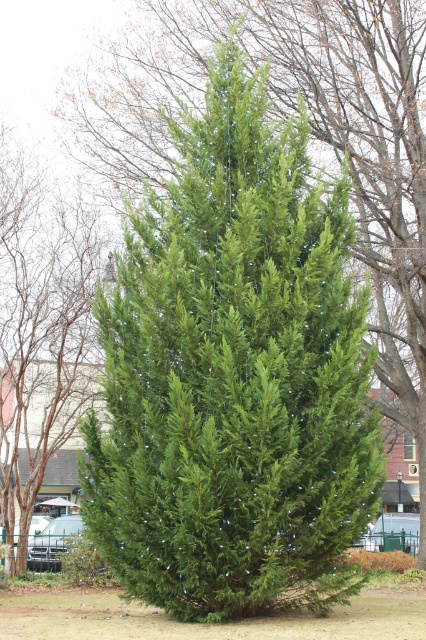
Question: Which of the following is the farthest from the observer?

Choices:
 (A) green matte evergreen tree at center
 (B) green matte fir tree at center

Answer: (A)

Question: Which of the following is the farthest from the observer?

Choices:
 (A) green matte evergreen tree at center
 (B) green matte fir tree at center

Answer: (A)

Question: Does green matte fir tree at center appear over green matte evergreen tree at center?

Choices:
 (A) yes
 (B) no

Answer: (A)

Question: Is green matte fir tree at center to the right of green matte evergreen tree at center from the viewer's perspective?

Choices:
 (A) yes
 (B) no

Answer: (A)

Question: Does green matte fir tree at center appear on the left side of green matte evergreen tree at center?

Choices:
 (A) yes
 (B) no

Answer: (B)

Question: Among these objects, which one is farthest from the camera?

Choices:
 (A) green matte fir tree at center
 (B) green matte evergreen tree at center

Answer: (B)